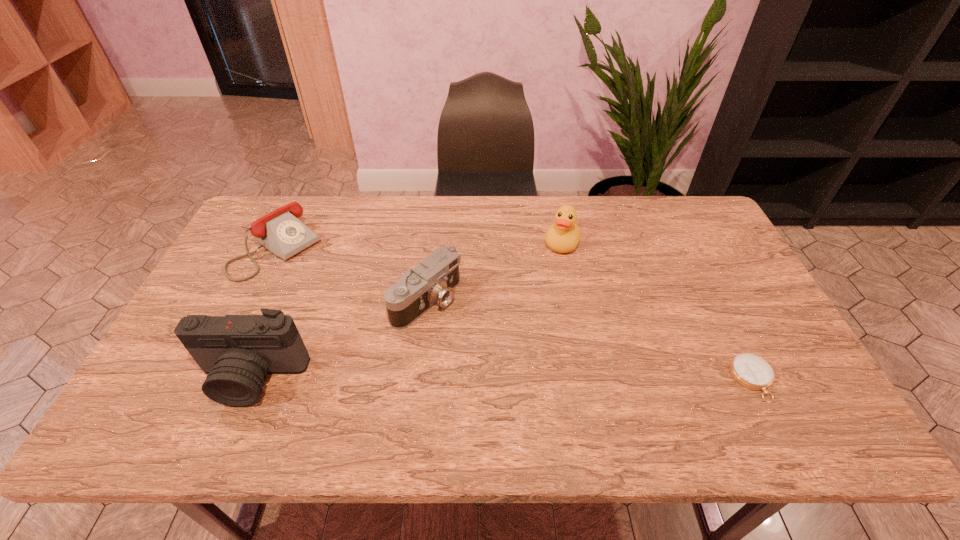
Where is `the left camera`? The height and width of the screenshot is (540, 960). the left camera is located at coordinates (237, 352).

You are a GUI agent. You are given a task and a screenshot of the screen. Output one action in this format:
    pyautogui.click(x=<x>, y=<y>)
    Task: Click on the taller camera
    The image size is (960, 540).
    Given the screenshot: What is the action you would take?
    pyautogui.click(x=237, y=352)

The width and height of the screenshot is (960, 540). I want to click on compass, so click(x=749, y=370).

At what (x,y) coordinates should I click in order to perform the action: click on the rightmost object. Please return your answer as a coordinate pair (x, y). Image resolution: width=960 pixels, height=540 pixels. Looking at the image, I should click on (749, 370).

Locate an element on the screen. The height and width of the screenshot is (540, 960). the shorter camera is located at coordinates (433, 281).

The height and width of the screenshot is (540, 960). I want to click on the right camera, so click(433, 281).

The image size is (960, 540). I want to click on duck, so click(x=563, y=236).

Where is `telephone`? The width and height of the screenshot is (960, 540). telephone is located at coordinates (281, 232).

At what (x,y) coordinates should I click in order to perform the action: click on free space located on the left of the compass. Please return your answer as a coordinate pair (x, y). This screenshot has height=540, width=960. Looking at the image, I should click on (621, 380).

Locate an element on the screen. The height and width of the screenshot is (540, 960). vacant space located 0.070m on the lens of the third object from left to right is located at coordinates (471, 332).